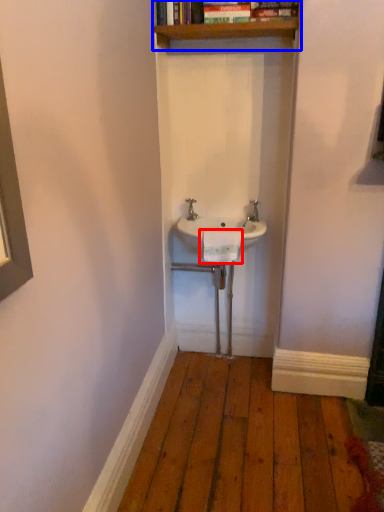
Question: Which object appears farthest to the camera in this image, towel bar (highlighted by a red box) or shelf (highlighted by a blue box)?

Choices:
 (A) towel bar
 (B) shelf

Answer: (A)